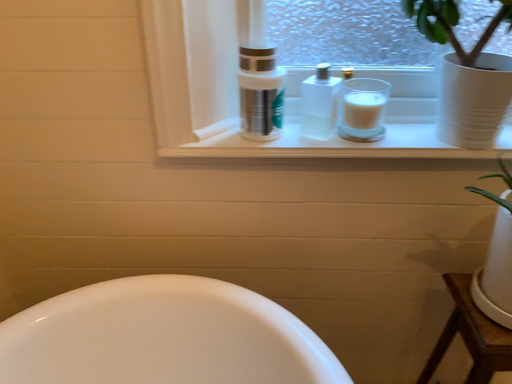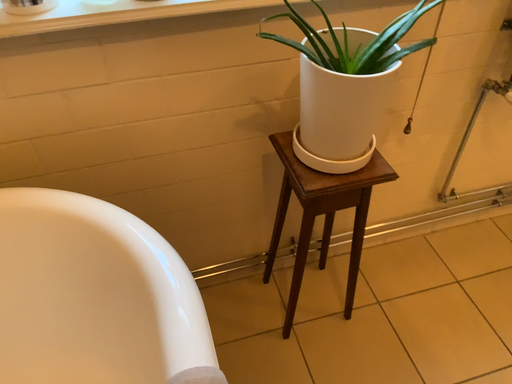
Question: Which way did the camera rotate in the video?

Choices:
 (A) rotated left
 (B) rotated right

Answer: (B)